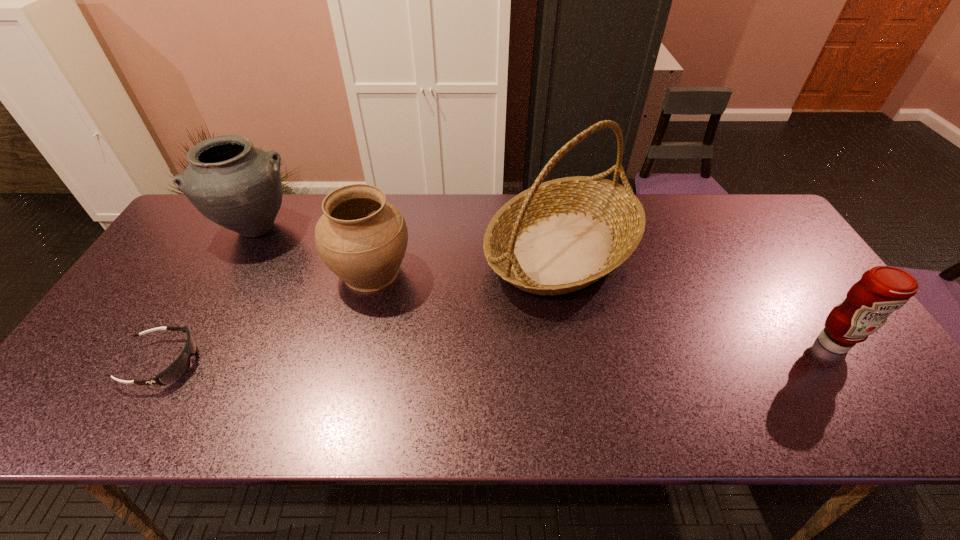
You are a GUI agent. You are given a task and a screenshot of the screen. Output one action in this format:
    pyautogui.click(x=<x>, y=<y>)
    Task: Click on the free region located 0.080m on the front and sides of the goggles
    Image resolution: width=960 pixels, height=540 pixels.
    Given the screenshot: What is the action you would take?
    pyautogui.click(x=230, y=362)

The width and height of the screenshot is (960, 540). Identify the location of basket present at the far edge. (557, 237).

This screenshot has width=960, height=540. Identify the location of urn that is at the far edge. (237, 186).

At what (x,y) coordinates should I click in order to perform the action: click on urn located at the left edge. Please return your answer as a coordinate pair (x, y). Image resolution: width=960 pixels, height=540 pixels. Looking at the image, I should click on (237, 186).

This screenshot has width=960, height=540. Identify the location of goggles situated at the left edge. (179, 367).

Find the location of a particular element. This screenshot has width=960, height=540. object present at the right edge is located at coordinates (882, 290).

Identify the location of object at the far left corner. (237, 186).

Where is `vacant area at the far edge of the desktop`? Image resolution: width=960 pixels, height=540 pixels. vacant area at the far edge of the desktop is located at coordinates (695, 203).

You are a GUI agent. You are given a task and a screenshot of the screen. Output one action in this format:
    pyautogui.click(x=<x>, y=<y>)
    Task: Click on the free space at the near edge
    The width and height of the screenshot is (960, 540).
    Given the screenshot: What is the action you would take?
    pyautogui.click(x=384, y=420)

Image resolution: width=960 pixels, height=540 pixels. I want to click on vacant space at the left edge, so click(119, 322).